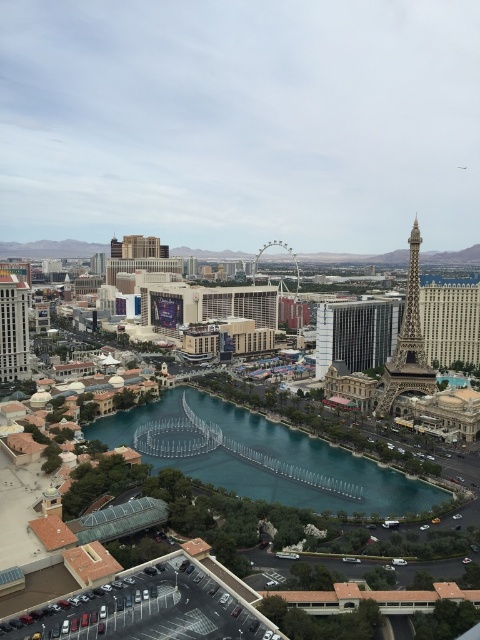
You are a tourist standing on the Las Vegas Strip and see the shiny gold eiffel tower at right and the matte silver hotel at left. Which structure would appear larger to you from your current position?

The shiny gold eiffel tower at right appears larger because it is taller than the matte silver hotel at left.

You are standing at the camera position and want to take a photo of the reflective glass fountain at center. Considering the distance between you and the fountain, would you need to use a zoom lens to capture the fountain clearly in your photo?

The reflective glass fountain at center is 72.94 meters away from the camera. To capture it clearly from that distance, you would need to use a zoom lens to ensure the fountain appears sharp and detailed in the photo.

You are standing on the Las Vegas Strip and see the reflective glass fountain at center and the matte silver hotel at left. Which object is positioned lower in the image?

The reflective glass fountain at center is positioned lower than the matte silver hotel at left in the image.